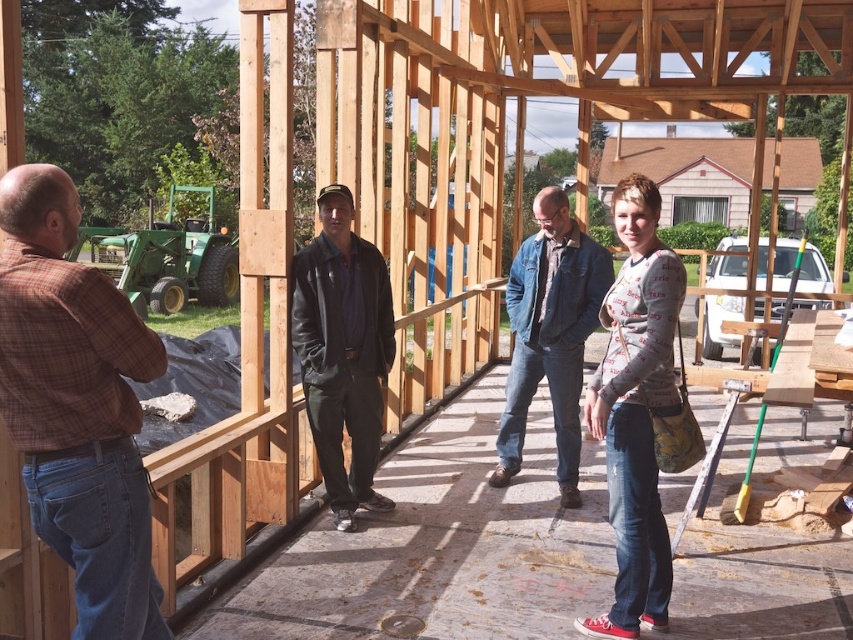
You are standing at point (x=138, y=342) and want to walk to point (x=366, y=486) in the construction site. Are you able to walk directly to the destination without going around?

Yes, you can walk directly from point (x=138, y=342) to point (x=366, y=486) because point (x=138, y=342) is in front of point (x=366, y=486), meaning there is a clear path between them.

You are a construction worker who needs to pass between the printed cotton sweater at center and the denim jacket at center. The path between them is narrow. Can you walk through the gap safely if you know your shoulder width is 0.5 meters?

The printed cotton sweater at center and denim jacket at center are 1.03 meters apart from each other. Since your shoulder width is 0.5 meters, there is enough space to pass safely as the distance between them is more than double your shoulder width.